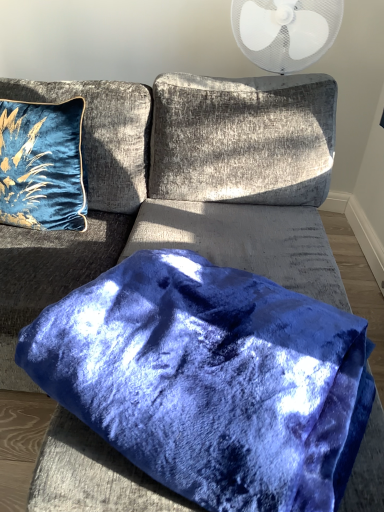
Question: From a real-world perspective, is velvet blue pillow at upper left, which appears as the first pillow when viewed from the back, positioned under velvet blue pillow at center, the first pillow from the front, based on gravity?

Choices:
 (A) no
 (B) yes

Answer: (A)

Question: From the image's perspective, is velvet blue pillow at upper left, which appears as the first pillow when viewed from the back, below velvet blue pillow at center, arranged as the 2th pillow when viewed from the top?

Choices:
 (A) yes
 (B) no

Answer: (B)

Question: Considering the relative sizes of velvet blue pillow at upper left, which appears as the second pillow when ordered from the bottom, and velvet blue pillow at center, which is counted as the first pillow, starting from the bottom, in the image provided, is velvet blue pillow at upper left, which appears as the second pillow when ordered from the bottom, taller than velvet blue pillow at center, which is counted as the first pillow, starting from the bottom,?

Choices:
 (A) no
 (B) yes

Answer: (B)

Question: From the image's perspective, does velvet blue pillow at upper left, the 2th pillow from the front, appear higher than velvet blue pillow at center, which is counted as the first pillow, starting from the bottom?

Choices:
 (A) yes
 (B) no

Answer: (A)

Question: Would you say velvet blue pillow at upper left, which appears as the first pillow when viewed from the back, is outside velvet blue pillow at center, arranged as the 2th pillow when viewed from the top?

Choices:
 (A) no
 (B) yes

Answer: (B)

Question: From the image's perspective, is velvet blue pillow at center, which is counted as the first pillow, starting from the bottom, positioned above or below velvet blue couch at center?

Choices:
 (A) below
 (B) above

Answer: (A)

Question: Would you say velvet blue pillow at center, which is counted as the first pillow, starting from the bottom, is inside or outside velvet blue couch at center?

Choices:
 (A) inside
 (B) outside

Answer: (A)

Question: Is point (188, 395) positioned closer to the camera than point (278, 256)?

Choices:
 (A) farther
 (B) closer

Answer: (B)

Question: Is velvet blue pillow at center, the second pillow from the back, bigger or smaller than velvet blue couch at center?

Choices:
 (A) small
 (B) big

Answer: (A)

Question: In terms of height, does velvet blue pillow at upper left, arranged as the 1th pillow when viewed from the left, look taller or shorter compared to velvet blue pillow at center, arranged as the first pillow when viewed from the right?

Choices:
 (A) short
 (B) tall

Answer: (B)

Question: Relative to velvet blue pillow at center, which is counted as the first pillow, starting from the bottom, is velvet blue pillow at upper left, which appears as the first pillow when viewed from the back, in front or behind?

Choices:
 (A) behind
 (B) front

Answer: (A)

Question: From the image's perspective, is velvet blue pillow at upper left, the second pillow viewed from the right, above or below velvet blue pillow at center, arranged as the first pillow when viewed from the right?

Choices:
 (A) above
 (B) below

Answer: (A)

Question: Is velvet blue pillow at upper left, acting as the first pillow starting from the top, bigger or smaller than velvet blue pillow at center, arranged as the 2th pillow when viewed from the top?

Choices:
 (A) big
 (B) small

Answer: (B)

Question: Visually, is velvet blue couch at center positioned to the left or to the right of velvet blue pillow at center, the second pillow from the back?

Choices:
 (A) left
 (B) right

Answer: (A)

Question: Is velvet blue couch at center taller or shorter than velvet blue pillow at center, acting as the second pillow starting from the left?

Choices:
 (A) short
 (B) tall

Answer: (B)